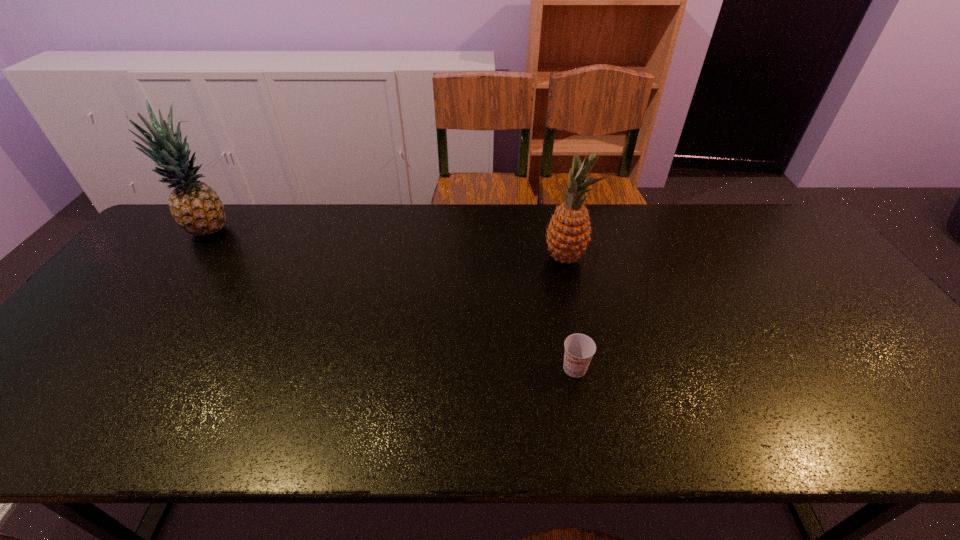
Identify the location of the leftmost object. The width and height of the screenshot is (960, 540). (195, 206).

At what (x,y) coordinates should I click in order to perform the action: click on the left pineapple. Please return your answer as a coordinate pair (x, y). The height and width of the screenshot is (540, 960). Looking at the image, I should click on (195, 206).

Identify the location of the shorter pineapple. (568, 235).

Image resolution: width=960 pixels, height=540 pixels. I want to click on the right pineapple, so click(568, 235).

Locate an element on the screen. Image resolution: width=960 pixels, height=540 pixels. Dixie cup is located at coordinates (579, 349).

Find the location of `the shortest object`. the shortest object is located at coordinates (579, 349).

I want to click on vacant space located on the front of the tallest object, so click(177, 278).

Locate an element on the screen. vacant region located on the back of the right pineapple is located at coordinates (560, 234).

This screenshot has height=540, width=960. I want to click on vacant region located 0.140m on the left of the Dixie cup, so click(x=500, y=368).

This screenshot has height=540, width=960. What are the coordinates of `object located at the left edge` in the screenshot? It's located at (195, 206).